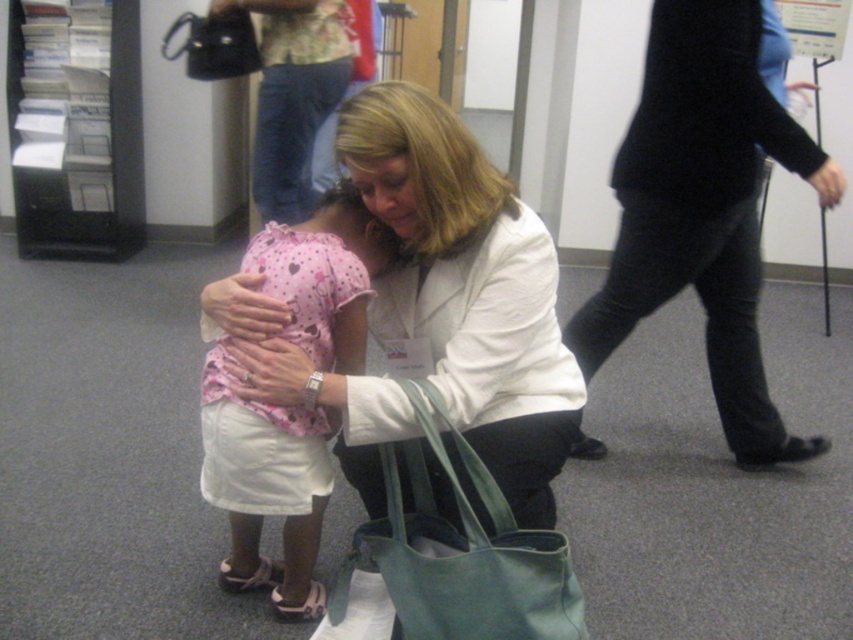
Question: Which object is positioned farthest from the pink dotted dress at center?

Choices:
 (A) white matte coat at center
 (B) black sweater at right
 (C) black leather handbag at upper left
 (D) green leather bag at lower center

Answer: (C)

Question: Does black sweater at right have a larger size compared to pink dotted dress at center?

Choices:
 (A) yes
 (B) no

Answer: (A)

Question: Which object is the closest to the black sweater at right?

Choices:
 (A) green leather bag at lower center
 (B) pink dotted dress at center

Answer: (B)

Question: Can you confirm if black sweater at right is positioned above green leather bag at lower center?

Choices:
 (A) no
 (B) yes

Answer: (B)

Question: Is white matte coat at center positioned before black leather handbag at upper left?

Choices:
 (A) no
 (B) yes

Answer: (B)

Question: Which point is closer to the camera taking this photo?

Choices:
 (A) (306, 337)
 (B) (770, 451)
 (C) (486, 212)
 (D) (444, 621)

Answer: (D)